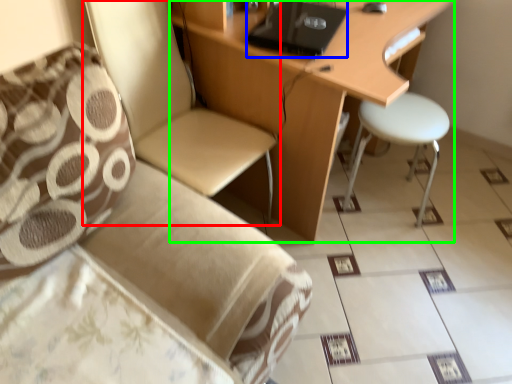
Question: Which object is positioned closest to chair (highlighted by a red box)? Select from laptop (highlighted by a blue box) and desk (highlighted by a green box).

Choices:
 (A) laptop
 (B) desk

Answer: (B)